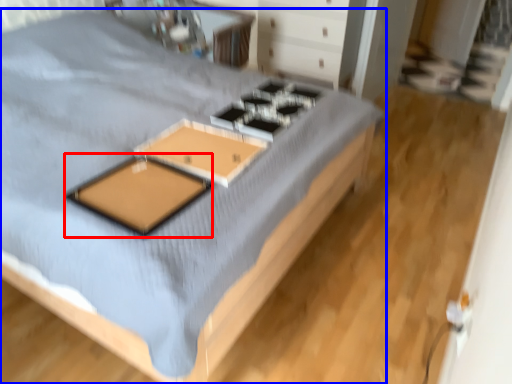
Question: Which of the following is the farthest to the observer, pad (highlighted by a red box) or bed (highlighted by a blue box)?

Choices:
 (A) pad
 (B) bed

Answer: (A)